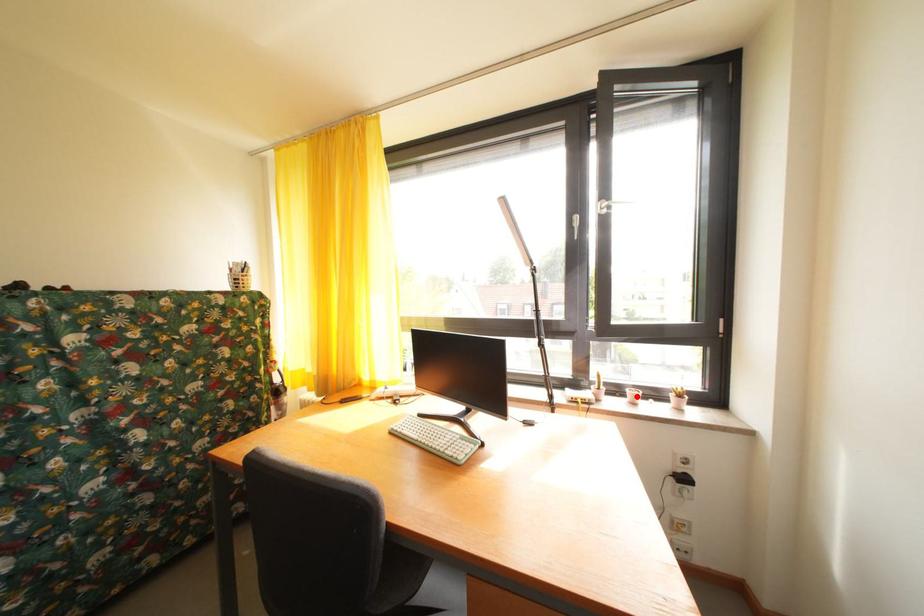
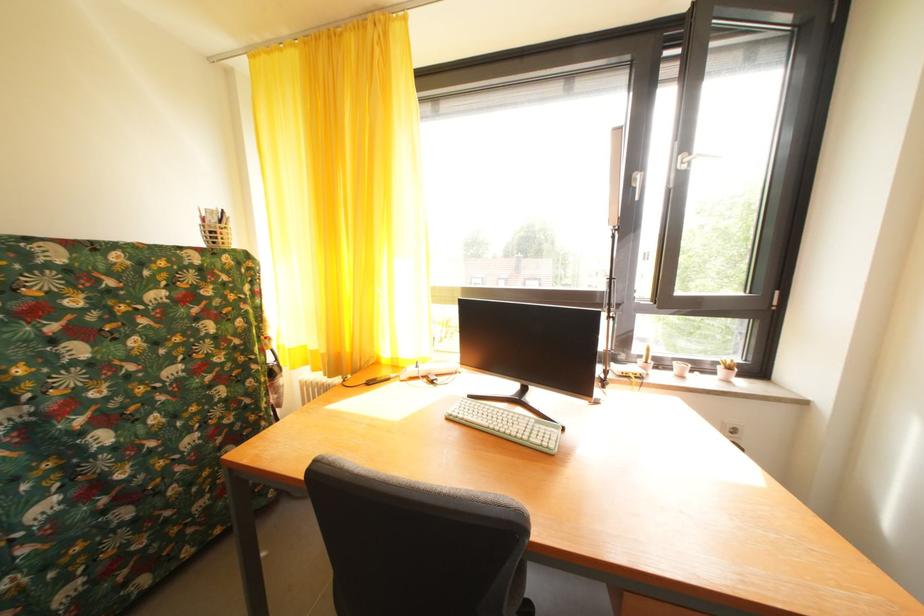
Locate, in the second image, the point that corresponds to the highlighted location in the first image.

(685, 370)